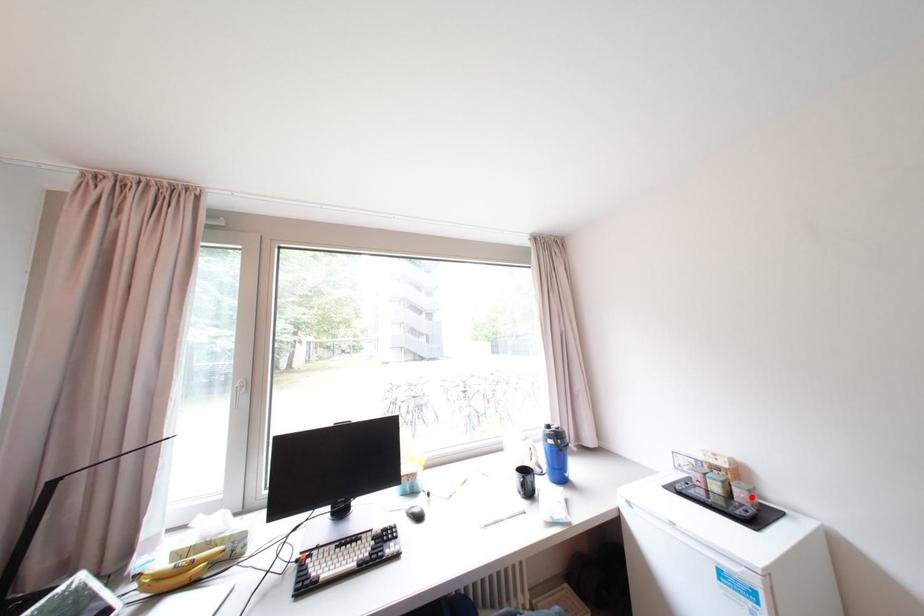
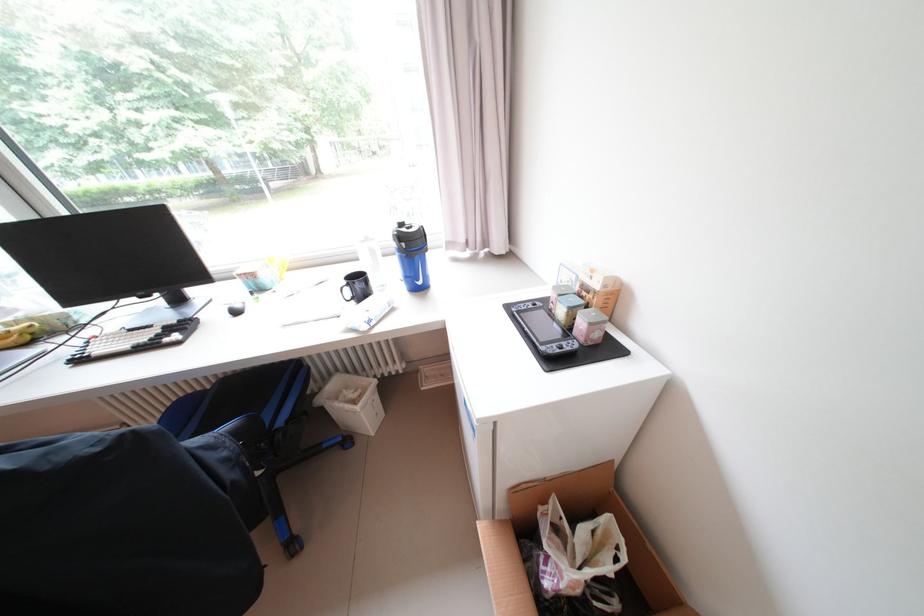
Locate, in the second image, the point that corresponds to the highlighted location in the first image.

(590, 329)